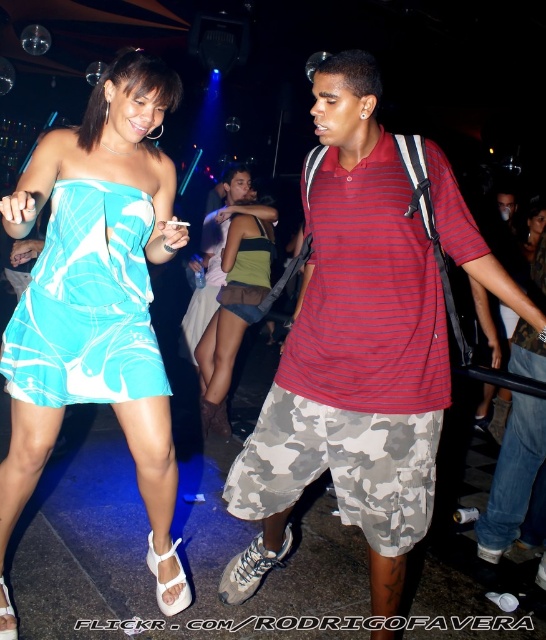
You are a photographer at the event and want to capture a photo of the striped cotton polo shirt at center and the green jersey at center. Which one is positioned lower in the frame?

The striped cotton polo shirt at center is positioned lower than the green jersey at center in the frame.

You are a photographer at the event and want to capture both the green textured tank top at center and the green jersey at center in a single frame. Which object should you focus on first to ensure both are in the shot?

The green textured tank top at center is positioned on the left side of the green jersey at center, so you should focus on the green textured tank top at center first to ensure both are in the shot.

You are a photographer at the event and want to capture both the turquoise silk dress at center and the green textured tank top at center in a single frame. Which clothing item should you focus on first to ensure both are in the frame?

The turquoise silk dress at center has a lesser height compared to the green textured tank top at center, so you should focus on the green textured tank top at center first to ensure both are in the frame.